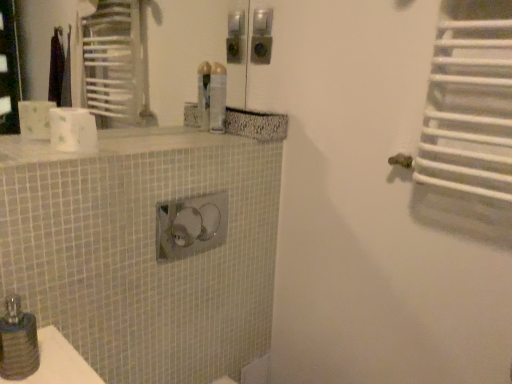
The width and height of the screenshot is (512, 384). What are the coordinates of `free spot above white mosaic tile counter top at upper center (from a real-world perspective)` in the screenshot? It's located at (163, 137).